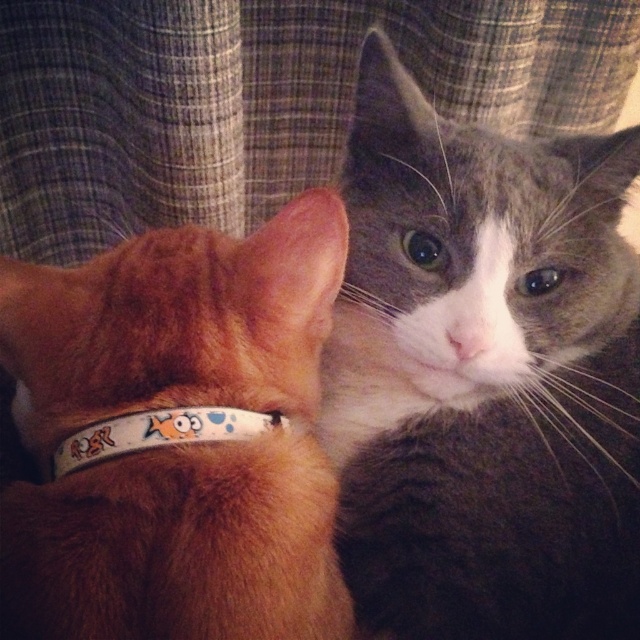
Is gray/white fur cat at center to the left of white plastic neckband at upper left from the viewer's perspective?

No, gray/white fur cat at center is not to the left of white plastic neckband at upper left.

Does gray/white fur cat at center have a lesser height compared to white plastic neckband at upper left?

No.

Is point (378, 120) more distant than point (176, 444)?

Yes, it is.

The height and width of the screenshot is (640, 640). In order to click on gray/white fur cat at center in this screenshot , I will do `click(483, 376)`.

Is gray/white fur cat at center bigger than orange fur cat at left?

Yes, gray/white fur cat at center is bigger than orange fur cat at left.

Does gray/white fur cat at center have a lesser height compared to orange fur cat at left?

No.

This screenshot has width=640, height=640. I want to click on gray/white fur cat at center, so click(483, 376).

Is orange fur cat at left wider than white plastic neckband at upper left?

Yes.

Is orange fur cat at left shorter than white plastic neckband at upper left?

No, orange fur cat at left is not shorter than white plastic neckband at upper left.

Find the location of a particular element. This screenshot has width=640, height=640. orange fur cat at left is located at coordinates (177, 436).